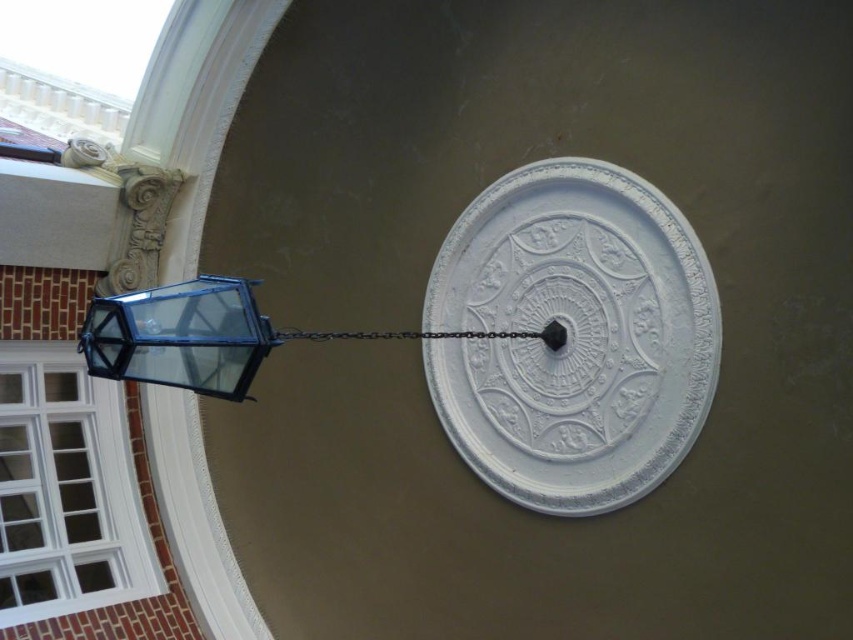
In the scene shown: You are an architect examining the building facade. You need to determine if the blue glass lantern at upper left can be lowered to the same height as the black metal chain at center without moving the chain. Based on their current heights, is this possible?

The blue glass lantern at upper left is much taller than the black metal chain at center. Lowering it would require reducing its height, which may not be feasible without altering its structure. Therefore, it is unlikely possible to lower the blue glass lantern at upper left to match the black metal chain at center without moving the chain.

You are an architect examining the building facade. You need to determine the order of layers between the blue glass lantern at upper left and the black metal chain at center. Which object is closer to you?

The blue glass lantern at upper left is closer to you than the black metal chain at center.

You are an architect examining the building facade. You need to determine if the white textured clock at center can fit into a display case that can only accommodate items narrower than the black metal chain at center. Can it fit?

The white textured clock at center has a width less than the black metal chain at center, so it can fit into the display case designed for items narrower than the chain.